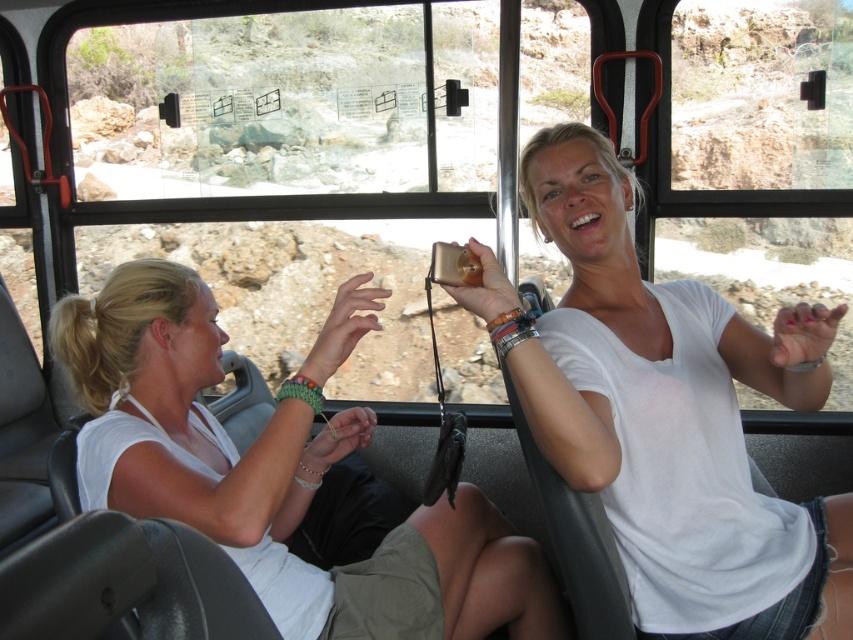
Is white cotton shirt at center bigger than white matte shirt at center?

No.

Is point (608, 516) positioned in front of point (74, 380)?

Yes, point (608, 516) is closer to viewer.

Is point (595, 486) farther from viewer compared to point (397, 506)?

That is False.

Where is `white cotton shirt at center`? The image size is (853, 640). white cotton shirt at center is located at coordinates (666, 413).